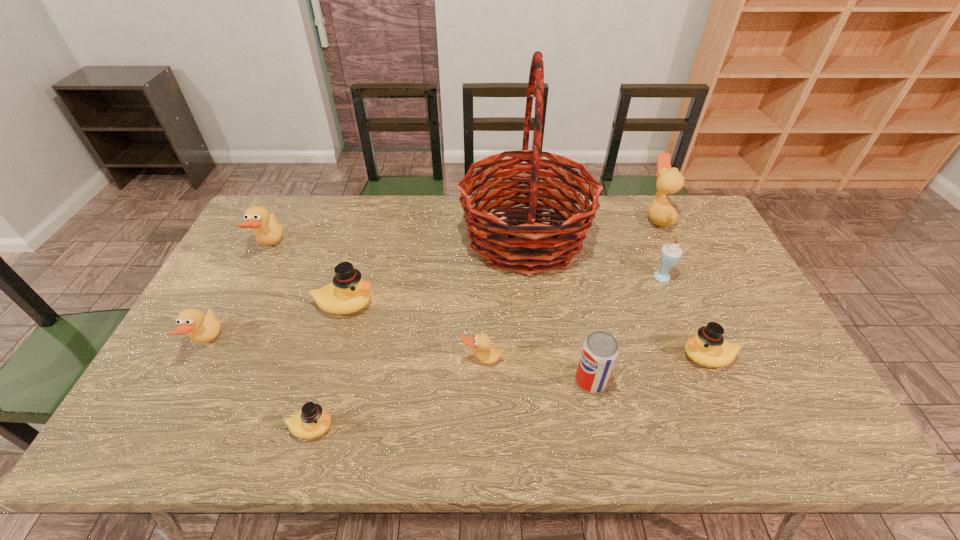
You are a GUI agent. You are given a task and a screenshot of the screen. Output one action in this format:
    pyautogui.click(x=<x>, y=<y>)
    Task: Click on the second biggest yellow duck
    The height and width of the screenshot is (540, 960).
    Given the screenshot: What is the action you would take?
    pyautogui.click(x=708, y=348)

Identify the location of the smallest tan duck. The image size is (960, 540). (481, 343).

Where is `the fifth duck from left to right`? This screenshot has height=540, width=960. the fifth duck from left to right is located at coordinates (481, 343).

Where is `the nearest duck`? Image resolution: width=960 pixels, height=540 pixels. the nearest duck is located at coordinates (311, 422).

Locate an element on the screen. The image size is (960, 540). the nearest object is located at coordinates (311, 422).

At what (x,y) coordinates should I click in order to perform the action: click on free space located on the front of the tallest object. Please return your answer as a coordinate pair (x, y). The height and width of the screenshot is (540, 960). Looking at the image, I should click on (536, 338).

In order to click on vacant position located on the beak of the rightmost tan duck in this screenshot , I will do `click(624, 217)`.

At what (x,y) coordinates should I click in order to perform the action: click on vacant region located on the beak of the rightmost tan duck. Please return your answer as a coordinate pair (x, y). Looking at the image, I should click on (548, 217).

Image resolution: width=960 pixels, height=540 pixels. In order to click on vacant space located 0.390m on the beak of the rightmost tan duck in this screenshot , I will do `click(534, 217)`.

The image size is (960, 540). Identify the location of vacant space located on the straw side of the milkshake. (578, 279).